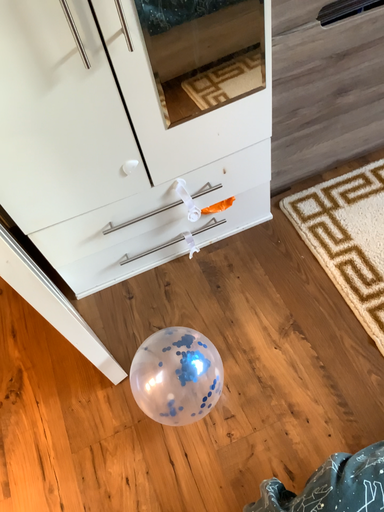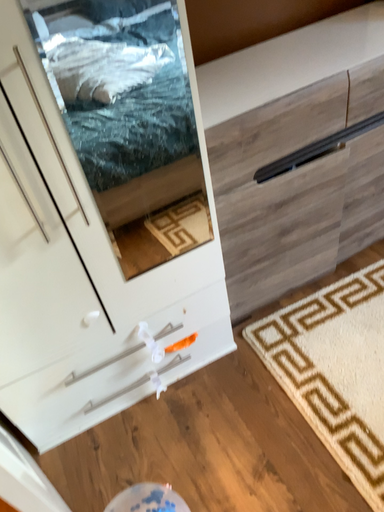
Question: Which way did the camera rotate in the video?

Choices:
 (A) rotated downward
 (B) rotated upward

Answer: (B)